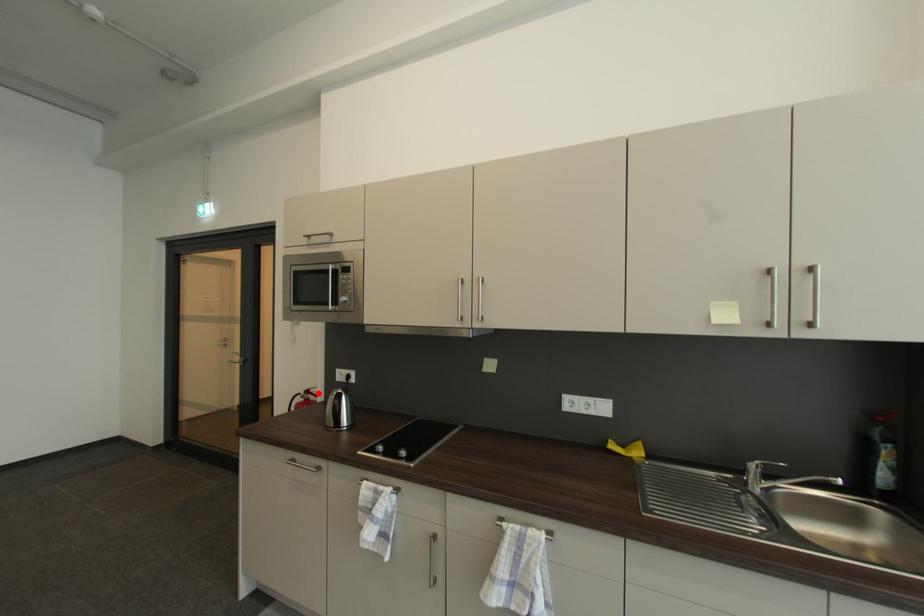
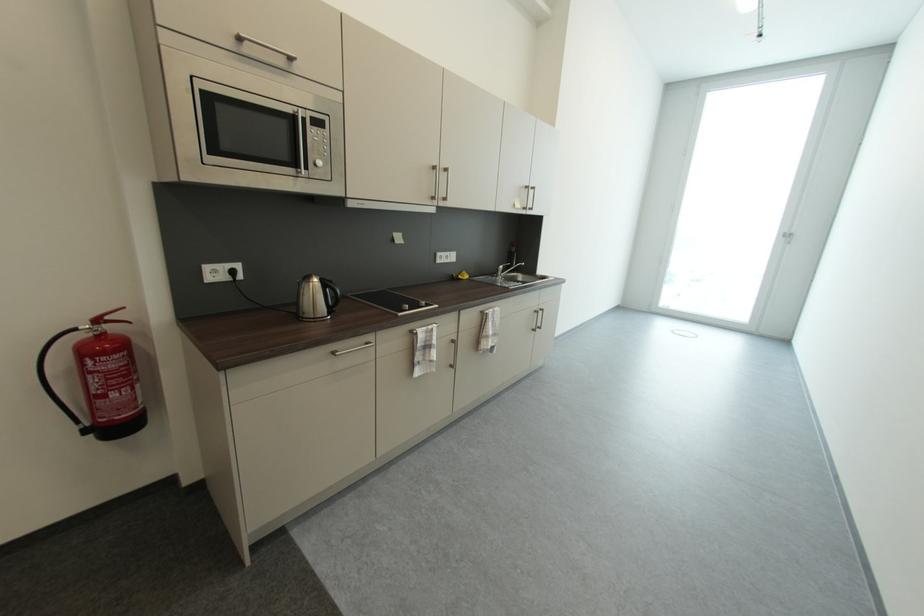
Question: I am providing you with two images of the same scene from different viewpoints. A red point is shown in image1. For the corresponding object point in image2, is it positioned nearer or farther from the camera?

Choices:
 (A) Nearer
 (B) Farther

Answer: (A)